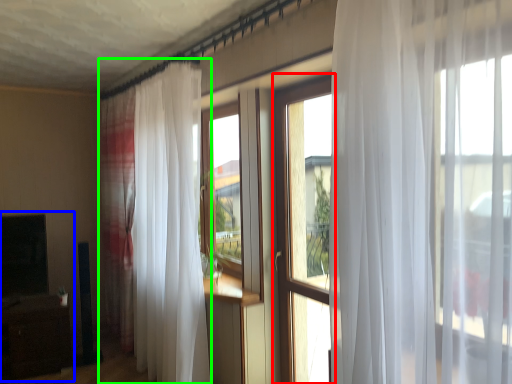
Question: Which object is positioned closest to window (highlighted by a red box)? Select from entertainment center (highlighted by a blue box) and curtain (highlighted by a green box).

Choices:
 (A) entertainment center
 (B) curtain

Answer: (B)